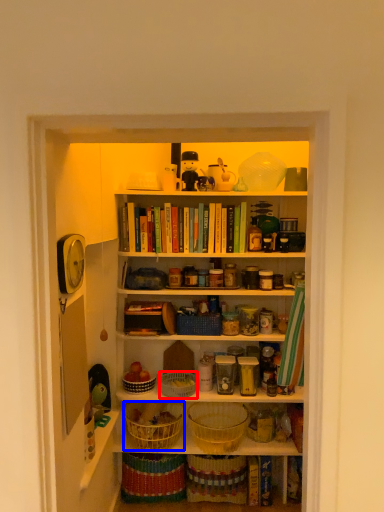
Question: Which object is further to the camera taking this photo, basket (highlighted by a red box) or basket (highlighted by a blue box)?

Choices:
 (A) basket
 (B) basket

Answer: (A)